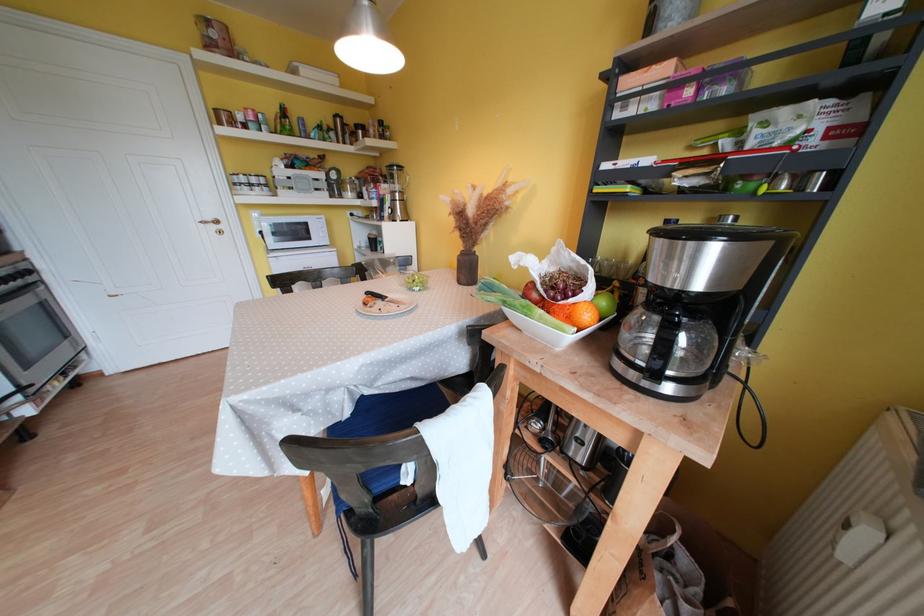
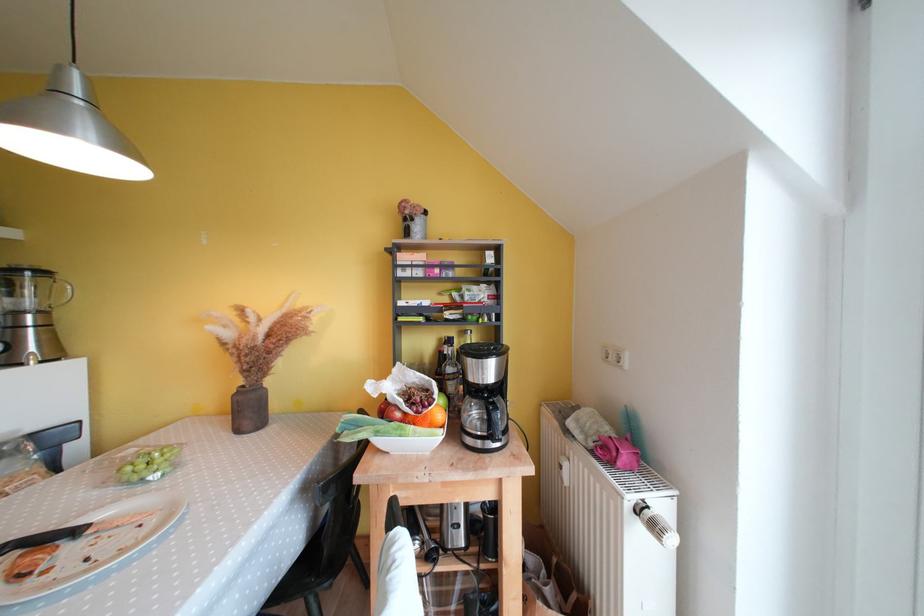
Find the pixel in the second image that matches (x=629, y=111) in the first image.

(409, 274)